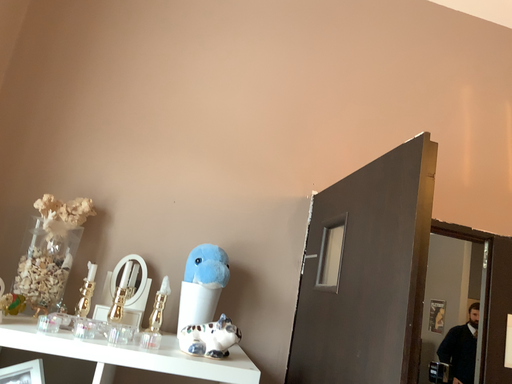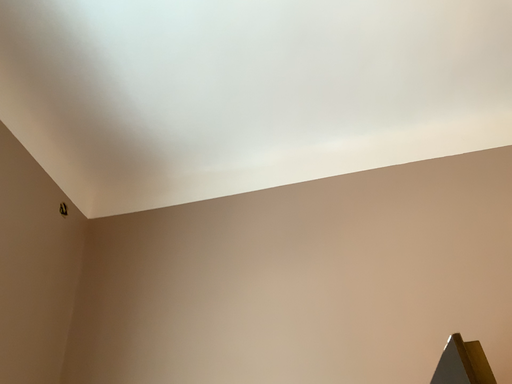
Question: Which way did the camera rotate in the video?

Choices:
 (A) rotated upward
 (B) rotated downward

Answer: (A)